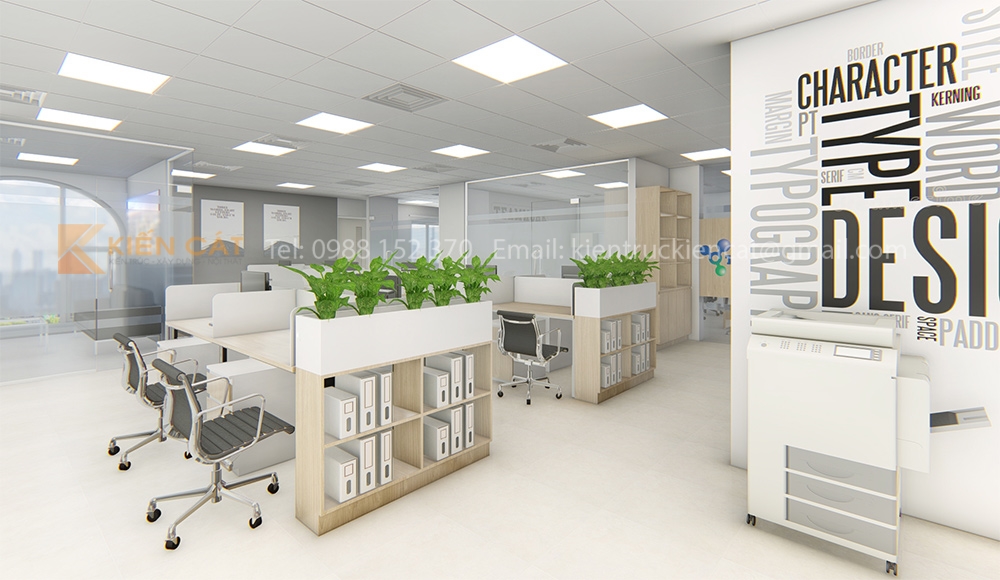
Identify the location of chairs. (530, 342), (220, 426), (143, 387).